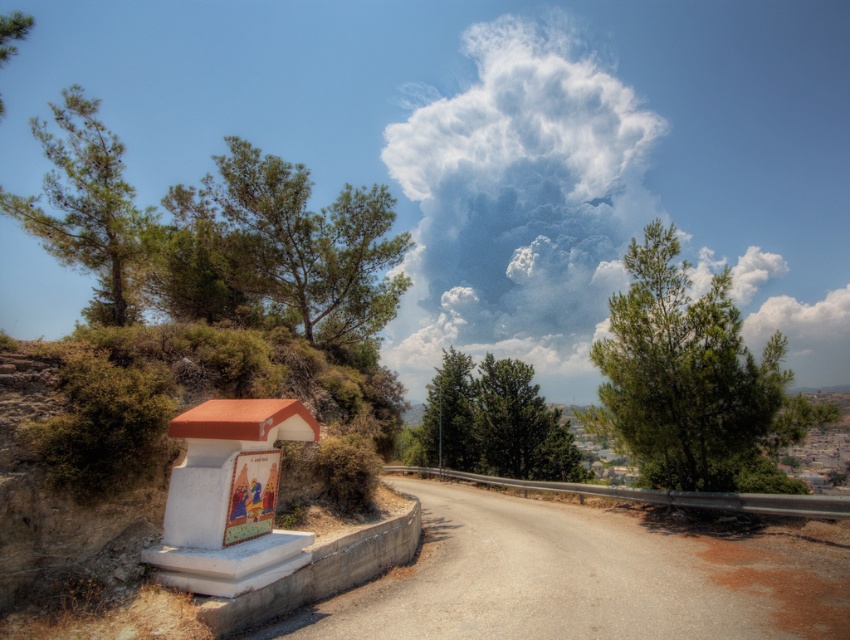
Measure the distance between point (x=391, y=301) and camera.

Point (x=391, y=301) is 69.49 feet away from camera.

Is green leafy tree at upper left to the right of green textured tree at center from the viewer's perspective?

Incorrect, green leafy tree at upper left is not on the right side of green textured tree at center.

I want to click on green leafy tree at upper left, so click(298, 243).

Is point (471, 452) farther from camera compared to point (457, 416)?

No, (471, 452) is in front of (457, 416).

How distant is green textured tree at center from green leafy tree at center?

A distance of 1.43 meters exists between green textured tree at center and green leafy tree at center.

Is point (476, 452) positioned in front of point (466, 435)?

Yes, it is.

The height and width of the screenshot is (640, 850). Identify the location of green textured tree at center. (491, 422).

The image size is (850, 640). What are the coordinates of `white fluffy cloud at upper center` in the screenshot? It's located at (626, 179).

Which is below, white fluffy cloud at upper center or green leafy tree at left?

green leafy tree at left is below.

Where is `white fluffy cloud at upper center`? This screenshot has height=640, width=850. white fluffy cloud at upper center is located at coordinates (626, 179).

Locate an element on the screen. Image resolution: width=850 pixels, height=640 pixels. white fluffy cloud at upper center is located at coordinates (626, 179).